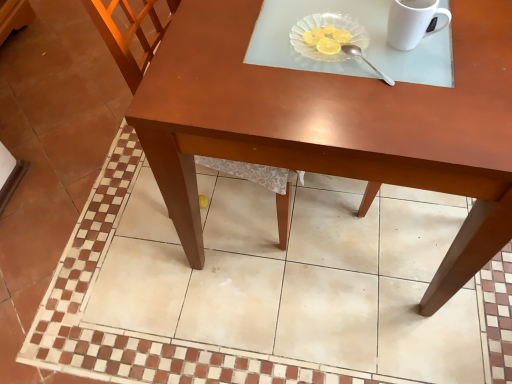
Question: Does transparent glass plate at upper center have a greater height compared to white glossy mug at upper right?

Choices:
 (A) yes
 (B) no

Answer: (B)

Question: From the image's perspective, is transparent glass plate at upper center below white glossy mug at upper right?

Choices:
 (A) yes
 (B) no

Answer: (A)

Question: Does transparent glass plate at upper center have a lesser width compared to white glossy mug at upper right?

Choices:
 (A) no
 (B) yes

Answer: (A)

Question: Are transparent glass plate at upper center and white glossy mug at upper right located far from each other?

Choices:
 (A) no
 (B) yes

Answer: (A)

Question: From the image's perspective, is transparent glass plate at upper center on white glossy mug at upper right?

Choices:
 (A) no
 (B) yes

Answer: (A)

Question: From a real-world perspective, is matte brown table at center above or below matte wood table at center?

Choices:
 (A) above
 (B) below

Answer: (B)

Question: Does point (306, 349) appear closer or farther from the camera than point (237, 74)?

Choices:
 (A) farther
 (B) closer

Answer: (A)

Question: From the image's perspective, is matte brown table at center positioned above or below matte wood table at center?

Choices:
 (A) above
 (B) below

Answer: (B)

Question: Visually, is matte brown table at center positioned to the left or to the right of matte wood table at center?

Choices:
 (A) left
 (B) right

Answer: (A)

Question: From the image's perspective, is wooden chair at center above or below matte brown table at center?

Choices:
 (A) above
 (B) below

Answer: (A)

Question: From a real-world perspective, is wooden chair at center positioned above or below matte brown table at center?

Choices:
 (A) below
 (B) above

Answer: (B)

Question: Is wooden chair at center wider or thinner than matte brown table at center?

Choices:
 (A) thin
 (B) wide

Answer: (A)

Question: Is wooden chair at center to the left or to the right of matte brown table at center in the image?

Choices:
 (A) left
 (B) right

Answer: (B)

Question: Considering the positions of matte wood table at center and silver metallic spoon at upper center in the image, is matte wood table at center taller or shorter than silver metallic spoon at upper center?

Choices:
 (A) tall
 (B) short

Answer: (A)

Question: From the image's perspective, is matte wood table at center positioned above or below silver metallic spoon at upper center?

Choices:
 (A) above
 (B) below

Answer: (A)